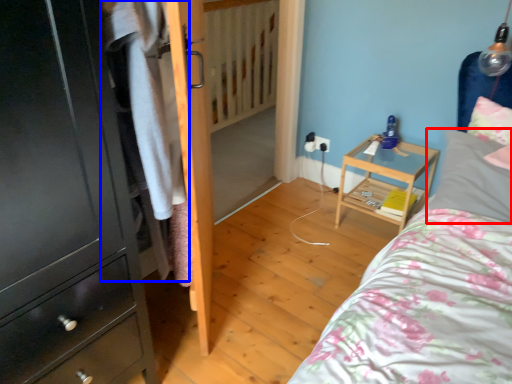
Question: Which of the following is the farthest to the observer, pillow (highlighted by a red box) or clothing (highlighted by a blue box)?

Choices:
 (A) pillow
 (B) clothing

Answer: (A)